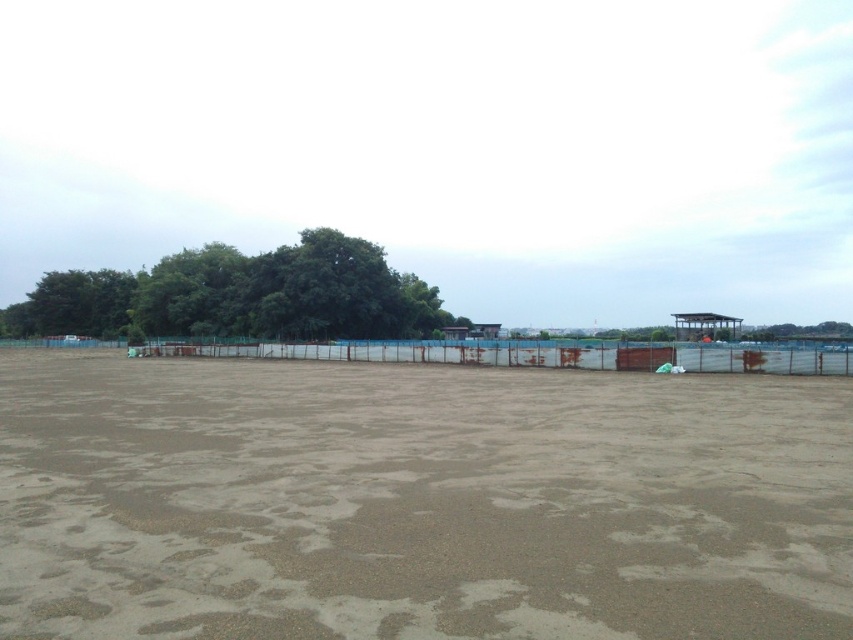
Question: Is brown sandy dirt field at center positioned before green leafy tree at upper left?

Choices:
 (A) yes
 (B) no

Answer: (A)

Question: Does brown sandy dirt field at center have a smaller size compared to green leafy tree at upper left?

Choices:
 (A) no
 (B) yes

Answer: (B)

Question: Is brown sandy dirt field at center thinner than green leafy tree at upper left?

Choices:
 (A) yes
 (B) no

Answer: (A)

Question: Which object appears farthest from the camera in this image?

Choices:
 (A) brown sandy dirt field at center
 (B) green leafy tree at upper left

Answer: (B)